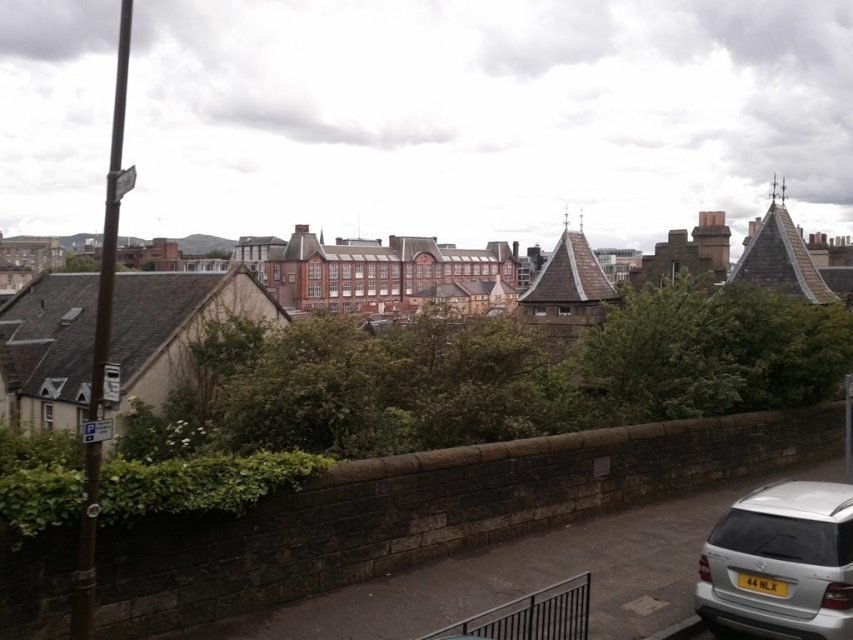
From the picture: You are a delivery driver who needs to park your truck next to the silver metallic suv at lower right. The truck requires a space that is at least as wide as the yellow matte license plate at lower right. Can you safely park your truck there?

The silver metallic suv at lower right might be wider than the yellow matte license plate at lower right. Since the truck requires a space at least as wide as the license plate, it is uncertain if the parking space is sufficient. Check the width before proceeding.

You are standing in the cityscape scene and want to walk towards the two points marked in the image. Which point, point (837,484) or point (759,584), will you reach first?

Point (837,484) is further to the viewer than point (759,584), so you will reach point (837,484) first.